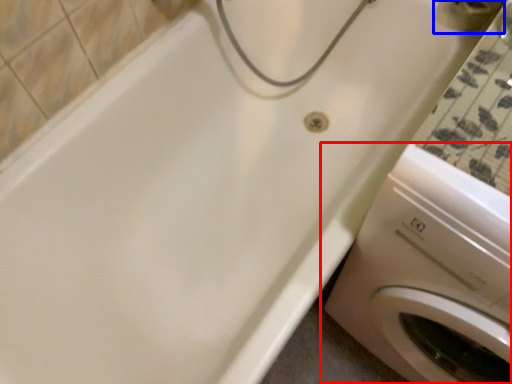
Question: Among these objects, which one is farthest to the camera, washing machine (highlighted by a red box) or faucet (highlighted by a blue box)?

Choices:
 (A) washing machine
 (B) faucet

Answer: (B)